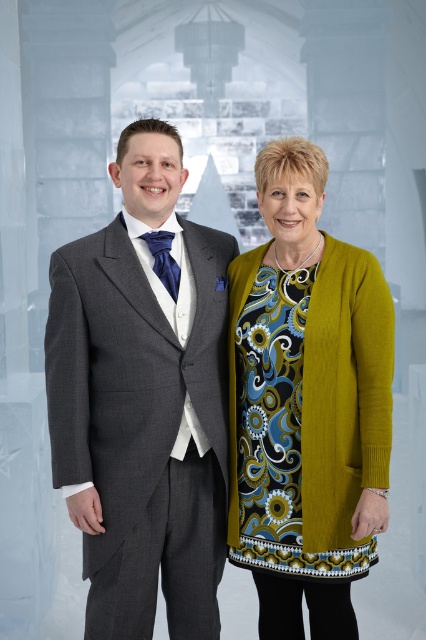
You are a photographer setting up for a portrait. You need to ensure that the distance between the two subjects wearing the charcoal gray suit at left and the green textured cardigan at right is at least 12 inches to frame them properly. Based on the scene, will the current spacing allow for this requirement?

The distance between the charcoal gray suit at left and the green textured cardigan at right is 12.67 inches, which exceeds the minimum requirement of 12 inches. Therefore, the current spacing allows for proper framing as it meets the requirement.

Based on the photo, you are standing in front of the two people in the image. Which of the two points, point (204, 502) or point (345, 426), is closer to you?

Point (204, 502) is closer to you because it is further to the camera than point (345, 426).